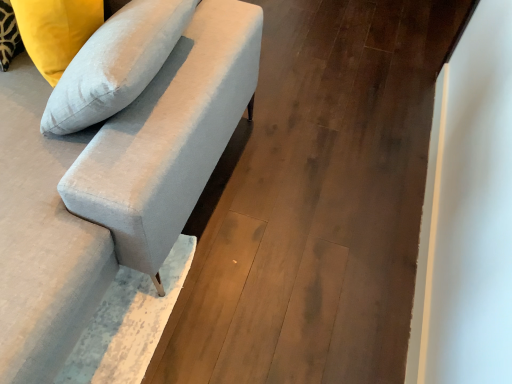
Find the location of a particular element. satin white pillow at upper left is located at coordinates (56, 31).

This screenshot has height=384, width=512. In order to click on suede-like gray couch at upper left in this screenshot , I will do `click(110, 184)`.

Describe the element at coordinates (316, 202) in the screenshot. The image size is (512, 384). I see `matte gray sofa at center-left` at that location.

What are the coordinates of `satin white pillow at upper left` in the screenshot? It's located at click(x=56, y=31).

From the picture: Which object is wider, satin white pillow at upper left or matte gray sofa at center-left?

matte gray sofa at center-left.

Is satin white pillow at upper left taller than matte gray sofa at center-left?

Yes, satin white pillow at upper left is taller than matte gray sofa at center-left.

How much distance is there between satin white pillow at upper left and matte gray sofa at center-left?

satin white pillow at upper left and matte gray sofa at center-left are 36.42 inches apart.

Is satin white pillow at upper left positioned with its back to matte gray sofa at center-left?

No, satin white pillow at upper left is not facing away from matte gray sofa at center-left.

This screenshot has width=512, height=384. I want to click on pillow located on the left of matte gray sofa at center-left, so click(56, 31).

Considering the positions of points (451, 26) and (27, 10), is point (451, 26) farther from camera compared to point (27, 10)?

Yes, point (451, 26) is behind point (27, 10).

Considering the positions of objects matte gray sofa at center-left and satin white pillow at upper left in the image provided, who is behind, matte gray sofa at center-left or satin white pillow at upper left?

matte gray sofa at center-left is behind.

Considering the relative positions of matte gray sofa at center-left and satin white pillow at upper left in the image provided, is matte gray sofa at center-left to the left of satin white pillow at upper left from the viewer's perspective?

No, matte gray sofa at center-left is not to the left of satin white pillow at upper left.

Would you say satin white pillow at upper left is part of suede-like gray couch at upper left's contents?

Absolutely, satin white pillow at upper left is inside suede-like gray couch at upper left.

Considering the relative positions of suede-like gray couch at upper left and satin white pillow at upper left in the image provided, is suede-like gray couch at upper left to the left or to the right of satin white pillow at upper left?

From the image, it's evident that suede-like gray couch at upper left is to the left of satin white pillow at upper left.

How far apart are suede-like gray couch at upper left and satin white pillow at upper left?

suede-like gray couch at upper left and satin white pillow at upper left are 13.75 inches apart.

Considering the points (167, 95) and (34, 46), which point is behind, point (167, 95) or point (34, 46)?

Point (34, 46)

Looking at their sizes, would you say matte gray sofa at center-left is wider or thinner than suede-like gray couch at upper left?

Clearly, matte gray sofa at center-left has less width compared to suede-like gray couch at upper left.

Is matte gray sofa at center-left further to camera compared to suede-like gray couch at upper left?

Yes, matte gray sofa at center-left is further from the camera.

Is matte gray sofa at center-left to the left of suede-like gray couch at upper left from the viewer's perspective?

In fact, matte gray sofa at center-left is to the right of suede-like gray couch at upper left.

From a real-world perspective, relative to suede-like gray couch at upper left, is matte gray sofa at center-left vertically above or below?

Clearly, from a real-world perspective, matte gray sofa at center-left is below suede-like gray couch at upper left.

Considering the positions of point (60, 224) and point (393, 175), is point (60, 224) closer or farther from the camera than point (393, 175)?

Point (60, 224) is closer to the camera than point (393, 175).

Locate an element on the screen. concrete on the right of suede-like gray couch at upper left is located at coordinates (316, 202).

Is the position of satin white pillow at upper left less distant than that of suede-like gray couch at upper left?

That is False.

Considering the relative sizes of satin white pillow at upper left and suede-like gray couch at upper left in the image provided, is satin white pillow at upper left smaller than suede-like gray couch at upper left?

Yes, satin white pillow at upper left is smaller than suede-like gray couch at upper left.

From a real-world perspective, who is located lower, satin white pillow at upper left or suede-like gray couch at upper left?

suede-like gray couch at upper left.

Could you tell me if satin white pillow at upper left is facing suede-like gray couch at upper left?

Yes, satin white pillow at upper left faces towards suede-like gray couch at upper left.

Image resolution: width=512 pixels, height=384 pixels. Find the location of `concrete on the right of satin white pillow at upper left`. concrete on the right of satin white pillow at upper left is located at coordinates (316, 202).

The height and width of the screenshot is (384, 512). In order to click on pillow located above the matte gray sofa at center-left (from a real-world perspective) in this screenshot , I will do `click(56, 31)`.

Estimate the real-world distances between objects in this image. Which object is further from matte gray sofa at center-left, suede-like gray couch at upper left or satin white pillow at upper left?

Among the two, satin white pillow at upper left is located further to matte gray sofa at center-left.

When comparing their distances from matte gray sofa at center-left, does satin white pillow at upper left or suede-like gray couch at upper left seem further?

satin white pillow at upper left lies further to matte gray sofa at center-left than the other object.

Which object lies nearer to the anchor point satin white pillow at upper left, suede-like gray couch at upper left or matte gray sofa at center-left?

Based on the image, suede-like gray couch at upper left appears to be nearer to satin white pillow at upper left.

From the image, which object appears to be nearer to suede-like gray couch at upper left, satin white pillow at upper left or matte gray sofa at center-left?

satin white pillow at upper left is closer to suede-like gray couch at upper left.

Estimate the real-world distances between objects in this image. Which object is further from suede-like gray couch at upper left, matte gray sofa at center-left or satin white pillow at upper left?

matte gray sofa at center-left is positioned further to the anchor suede-like gray couch at upper left.

From the image, which object appears to be farther from satin white pillow at upper left, matte gray sofa at center-left or suede-like gray couch at upper left?

matte gray sofa at center-left lies further to satin white pillow at upper left than the other object.

Where is `pillow located between suede-like gray couch at upper left and matte gray sofa at center-left in the left-right direction`? This screenshot has width=512, height=384. pillow located between suede-like gray couch at upper left and matte gray sofa at center-left in the left-right direction is located at coordinates (56, 31).